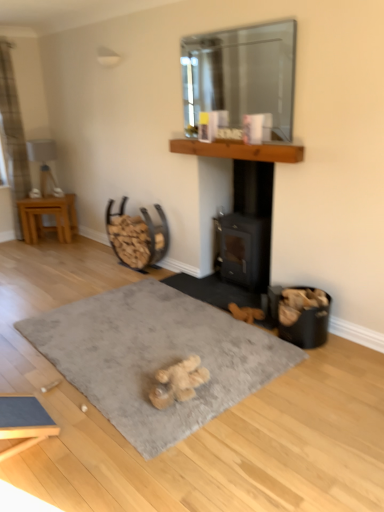
At what (x,y) coordinates should I click in order to perform the action: click on vacant space behind fuzzy beige teddy bear at center. Please return your answer as a coordinate pair (x, y). This screenshot has width=384, height=512. Looking at the image, I should click on (192, 352).